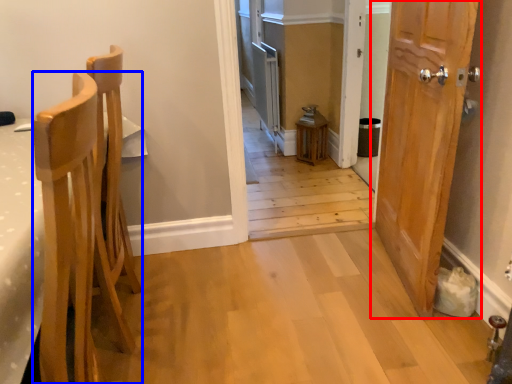
Question: Which point is closer to the camera, door (highlighted by a red box) or chair (highlighted by a blue box)?

Choices:
 (A) door
 (B) chair

Answer: (B)